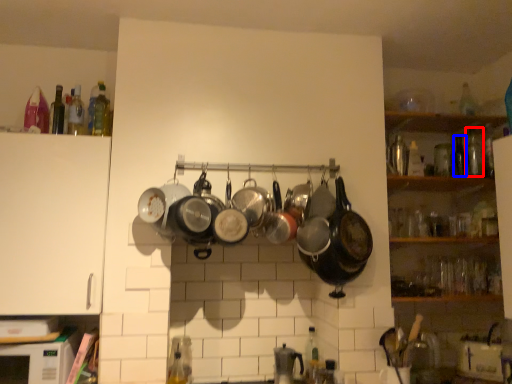
Question: Among these objects, which one is farthest to the camera, bottle (highlighted by a red box) or bottle (highlighted by a blue box)?

Choices:
 (A) bottle
 (B) bottle

Answer: (A)